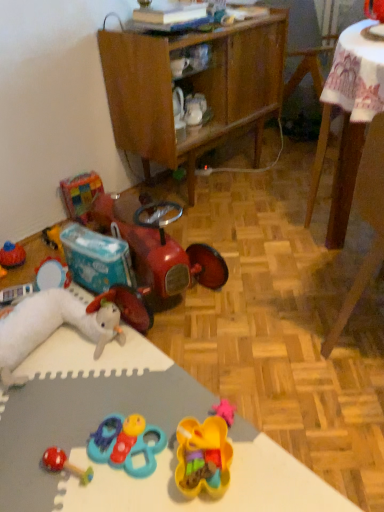
How much space does rubber duck at center, which is counted as the first toy, starting from the right, occupy horizontally?

rubber duck at center, which is counted as the first toy, starting from the right, is 15.33 centimeters in width.

What do you see at coordinates (203, 457) in the screenshot? Image resolution: width=384 pixels, height=512 pixels. I see `translucent plastic container at center, marked as the second toy in a right-to-left arrangement` at bounding box center [203, 457].

At what (x,y) coordinates should I click in order to perform the action: click on wooden chair at lower right. Please return your answer as a coordinate pair (x, y). Looking at the image, I should click on (367, 222).

I want to click on plastic toy at center, so click(x=147, y=421).

What do you see at coordinates (194, 89) in the screenshot? This screenshot has width=384, height=512. I see `wooden cabinet at upper center` at bounding box center [194, 89].

Measure the distance between wooden cabinet at upper center and camera.

They are 5.23 feet apart.

The width and height of the screenshot is (384, 512). In order to click on white plush rabbit at lower left, arranged as the sixth toy when viewed from the right in this screenshot , I will do `click(53, 327)`.

From the image's perspective, is wooden cabinet at upper center positioned above or below wooden chair at lower right?

Based on their image positions, wooden cabinet at upper center is located above wooden chair at lower right.

Based on the photo, which object is closer to the camera taking this photo, wooden cabinet at upper center or wooden chair at lower right?

wooden chair at lower right.

Can you tell me how much wooden cabinet at upper center and wooden chair at lower right differ in facing direction?

They differ by 91.2 degrees in their facing directions.

Looking at this image, choose the correct answer: Is wooden cabinet at upper center inside wooden chair at lower right or outside it?

wooden cabinet at upper center lies outside wooden chair at lower right.

From the picture: From a real-world perspective, who is located lower, translucent plastic container at center, the fifth toy viewed from the left, or rubber duck at center, which is counted as the first toy, starting from the right?

translucent plastic container at center, the fifth toy viewed from the left, is physically lower.

Considering the relative sizes of translucent plastic container at center, the fifth toy viewed from the left, and rubber duck at center, which appears as the sixth toy when viewed from the left, in the image provided, is translucent plastic container at center, the fifth toy viewed from the left, shorter than rubber duck at center, which appears as the sixth toy when viewed from the left,?

Indeed, translucent plastic container at center, the fifth toy viewed from the left, has a lesser height compared to rubber duck at center, which appears as the sixth toy when viewed from the left.

Is translucent plastic container at center, marked as the second toy in a right-to-left arrangement, facing towards rubber duck at center, which appears as the sixth toy when viewed from the left?

No, translucent plastic container at center, marked as the second toy in a right-to-left arrangement, is not facing towards rubber duck at center, which appears as the sixth toy when viewed from the left.

Consider the image. Considering the sizes of translucent plastic container at center, marked as the second toy in a right-to-left arrangement, and rubber duck at center, which appears as the sixth toy when viewed from the left, in the image, is translucent plastic container at center, marked as the second toy in a right-to-left arrangement, wider or thinner than rubber duck at center, which appears as the sixth toy when viewed from the left,?

Clearly, translucent plastic container at center, marked as the second toy in a right-to-left arrangement, has more width compared to rubber duck at center, which appears as the sixth toy when viewed from the left.

Are white plush rabbit at lower left, the 1th toy from the left, and multicolored plastic blocks at upper left, the second toy in the left-to-right sequence, making contact?

No, white plush rabbit at lower left, the 1th toy from the left, is not with multicolored plastic blocks at upper left, the second toy in the left-to-right sequence.

Looking at this image, is white plush rabbit at lower left, the 1th toy from the left, aimed at multicolored plastic blocks at upper left, marked as the 5th toy in a right-to-left arrangement?

No, white plush rabbit at lower left, the 1th toy from the left, is not turned towards multicolored plastic blocks at upper left, marked as the 5th toy in a right-to-left arrangement.

Considering the sizes of objects white plush rabbit at lower left, the 1th toy from the left, and multicolored plastic blocks at upper left, the second toy in the left-to-right sequence, in the image provided, who is bigger, white plush rabbit at lower left, the 1th toy from the left, or multicolored plastic blocks at upper left, the second toy in the left-to-right sequence,?

white plush rabbit at lower left, the 1th toy from the left, is bigger.

Is white plush rabbit at lower left, arranged as the sixth toy when viewed from the right, shorter than multicolored plastic blocks at upper left, marked as the 5th toy in a right-to-left arrangement?

Correct, white plush rabbit at lower left, arranged as the sixth toy when viewed from the right, is not as tall as multicolored plastic blocks at upper left, marked as the 5th toy in a right-to-left arrangement.

From a real-world perspective, which is physically below, rubber duck at center, which is counted as the first toy, starting from the right, or translucent plastic container at center, the fifth toy viewed from the left?

translucent plastic container at center, the fifth toy viewed from the left, is physically lower.

Is translucent plastic container at center, marked as the second toy in a right-to-left arrangement, located within rubber duck at center, which is counted as the first toy, starting from the right?

No, translucent plastic container at center, marked as the second toy in a right-to-left arrangement, is not a part of rubber duck at center, which is counted as the first toy, starting from the right.

Does rubber duck at center, which appears as the sixth toy when viewed from the left, have a greater width compared to translucent plastic container at center, marked as the second toy in a right-to-left arrangement?

In fact, rubber duck at center, which appears as the sixth toy when viewed from the left, might be narrower than translucent plastic container at center, marked as the second toy in a right-to-left arrangement.

Which is more to the right, rubber duck at center, which is counted as the first toy, starting from the right, or translucent plastic container at center, marked as the second toy in a right-to-left arrangement?

Positioned to the right is rubber duck at center, which is counted as the first toy, starting from the right.

Looking at their sizes, would you say plastic toy at center is wider or thinner than white plush rabbit at lower left, the 1th toy from the left?

In the image, plastic toy at center appears to be wider than white plush rabbit at lower left, the 1th toy from the left.

From a real-world perspective, between plastic toy at center and white plush rabbit at lower left, arranged as the sixth toy when viewed from the right, who is vertically higher?

white plush rabbit at lower left, arranged as the sixth toy when viewed from the right, from a real-world perspective.

From the image's perspective, would you say plastic toy at center is shown under white plush rabbit at lower left, the 1th toy from the left?

Yes.

Is plastic toy at center oriented away from white plush rabbit at lower left, arranged as the sixth toy when viewed from the right?

No, white plush rabbit at lower left, arranged as the sixth toy when viewed from the right, is not at the back of plastic toy at center.

Between translucent plastic container at center, the fifth toy viewed from the left, and wooden cabinet at upper center, which one has less height?

Standing shorter between the two is translucent plastic container at center, the fifth toy viewed from the left.

From a real-world perspective, which is physically above, translucent plastic container at center, marked as the second toy in a right-to-left arrangement, or wooden cabinet at upper center?

wooden cabinet at upper center is physically above.

Between point (214, 478) and point (160, 89), which one is positioned in front?

The point (214, 478) is in front.

From the image's perspective, is translucent plastic container at center, the fifth toy viewed from the left, located above wooden cabinet at upper center?

No.

From the image's perspective, relative to multicolored plastic blocks at upper left, the second toy in the left-to-right sequence, is rubberized red car at lower left, positioned as the 3th toy in left-to-right order, above or below?

rubberized red car at lower left, positioned as the 3th toy in left-to-right order, is below multicolored plastic blocks at upper left, the second toy in the left-to-right sequence.

How many degrees apart are the facing directions of rubberized red car at lower left, placed as the fourth toy when sorted from right to left, and multicolored plastic blocks at upper left, marked as the 5th toy in a right-to-left arrangement?

The facing directions of rubberized red car at lower left, placed as the fourth toy when sorted from right to left, and multicolored plastic blocks at upper left, marked as the 5th toy in a right-to-left arrangement, are 1.34 degrees apart.

Can you confirm if rubberized red car at lower left, placed as the fourth toy when sorted from right to left, is positioned to the left of multicolored plastic blocks at upper left, marked as the 5th toy in a right-to-left arrangement?

In fact, rubberized red car at lower left, placed as the fourth toy when sorted from right to left, is to the right of multicolored plastic blocks at upper left, marked as the 5th toy in a right-to-left arrangement.

Is rubberized red car at lower left, positioned as the 3th toy in left-to-right order, looking in the opposite direction of multicolored plastic blocks at upper left, marked as the 5th toy in a right-to-left arrangement?

Yes.

I want to click on chair above the wooden cabinet at upper center (from a real-world perspective), so click(x=367, y=222).

You are a GUI agent. You are given a task and a screenshot of the screen. Output one action in this format:
    pyautogui.click(x=<x>, y=<y>)
    Task: Click on the 4th toy directly beneath the rubber duck at center, which is counted as the first toy, starting from the right (from a real-world perspective)
    
    Given the screenshot: What is the action you would take?
    pyautogui.click(x=203, y=457)

Which object lies further to the anchor point translucent plastic container at center, the fifth toy viewed from the left, white plush rabbit at lower left, the 1th toy from the left, or rubber duck at center, which is counted as the first toy, starting from the right?

Based on the image, rubber duck at center, which is counted as the first toy, starting from the right, appears to be further to translucent plastic container at center, the fifth toy viewed from the left.

From the image, which object appears to be nearer to multicolored plastic blocks at upper left, the second toy in the left-to-right sequence, teal plastic toy at center, positioned as the 3th toy in right-to-left order, or wooden chair at lower right?

teal plastic toy at center, positioned as the 3th toy in right-to-left order, lies closer to multicolored plastic blocks at upper left, the second toy in the left-to-right sequence, than the other object.

When comparing their distances from plastic toy at center, does wooden chair at lower right or wooden cabinet at upper center seem further?

wooden cabinet at upper center.

From the image, which object appears to be farther from wooden chair at lower right, plastic toy at center or wooden cabinet at upper center?

wooden cabinet at upper center is positioned further to the anchor wooden chair at lower right.

When comparing their distances from wooden chair at lower right, does multicolored plastic blocks at upper left, marked as the 5th toy in a right-to-left arrangement, or white plush rabbit at lower left, arranged as the sixth toy when viewed from the right, seem closer?

The object closer to wooden chair at lower right is white plush rabbit at lower left, arranged as the sixth toy when viewed from the right.

Considering their positions, is translucent plastic container at center, marked as the second toy in a right-to-left arrangement, positioned further to wooden chair at lower right than multicolored plastic blocks at upper left, the second toy in the left-to-right sequence?

The object further to wooden chair at lower right is multicolored plastic blocks at upper left, the second toy in the left-to-right sequence.

Considering their positions, is rubber duck at center, which appears as the sixth toy when viewed from the left, positioned further to translucent plastic container at center, the fifth toy viewed from the left, than rubberized red car at lower left, positioned as the 3th toy in left-to-right order?

Among the two, rubber duck at center, which appears as the sixth toy when viewed from the left, is located further to translucent plastic container at center, the fifth toy viewed from the left.

When comparing their distances from wooden cabinet at upper center, does plastic toy at center or rubberized red car at lower left, placed as the fourth toy when sorted from right to left, seem closer?

rubberized red car at lower left, placed as the fourth toy when sorted from right to left, is positioned closer to the anchor wooden cabinet at upper center.

What are the coordinates of `chair that lies between wooden cabinet at upper center and teal plastic toy at center, which appears as the fourth toy when viewed from the left, from top to bottom` in the screenshot? It's located at (367, 222).

Find the location of a particular element. This screenshot has height=512, width=384. cabinetry between rubberized red car at lower left, placed as the fourth toy when sorted from right to left, and rubber duck at center, which appears as the sixth toy when viewed from the left is located at coordinates (194, 89).

You are a GUI agent. You are given a task and a screenshot of the screen. Output one action in this format:
    pyautogui.click(x=<x>, y=<y>)
    Task: Click on the chair between plastic toy at center and multicolored plastic blocks at upper left, the second toy in the left-to-right sequence, from front to back
    The height and width of the screenshot is (512, 384).
    Given the screenshot: What is the action you would take?
    pyautogui.click(x=367, y=222)

Find the location of a particular element. Image resolution: width=384 pixels, height=512 pixels. toy between plastic toy at center and teal plastic toy at center, which appears as the fourth toy when viewed from the left, from front to back is located at coordinates (203, 457).